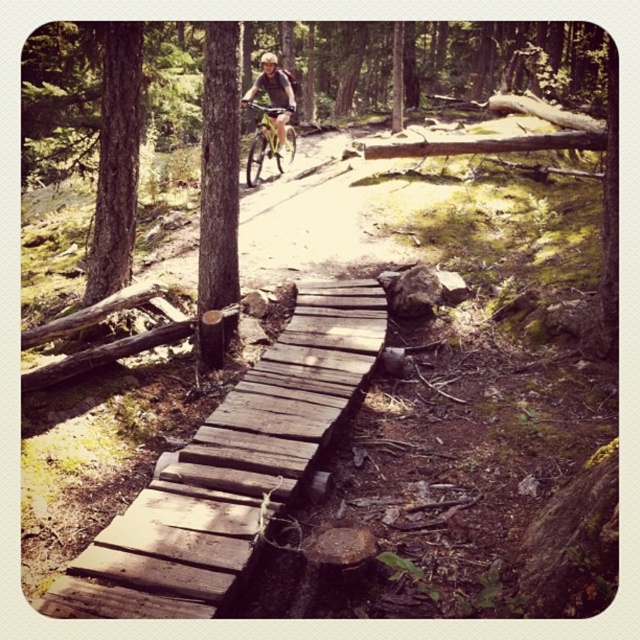
You are standing on the weathered wooden bridge at center and looking towards the matte black helmet at upper center. Which object is closer to you?

The weathered wooden bridge at center is closer to you than the matte black helmet at upper center.